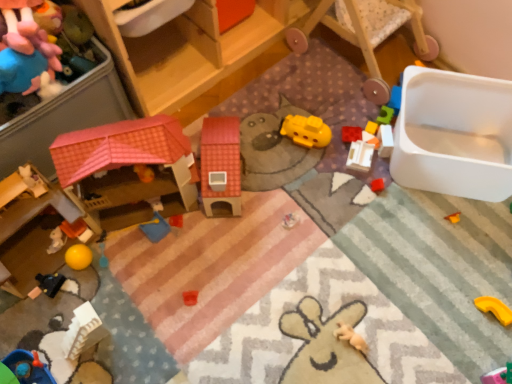
This screenshot has height=384, width=512. Find the location of `vacant space that's between yellow rubber toy at lower right, positioned as the 11th toy in left-to-right order, and white plastic blocks at right, which is the second toy in right-to-left order`. vacant space that's between yellow rubber toy at lower right, positioned as the 11th toy in left-to-right order, and white plastic blocks at right, which is the second toy in right-to-left order is located at coordinates (443, 237).